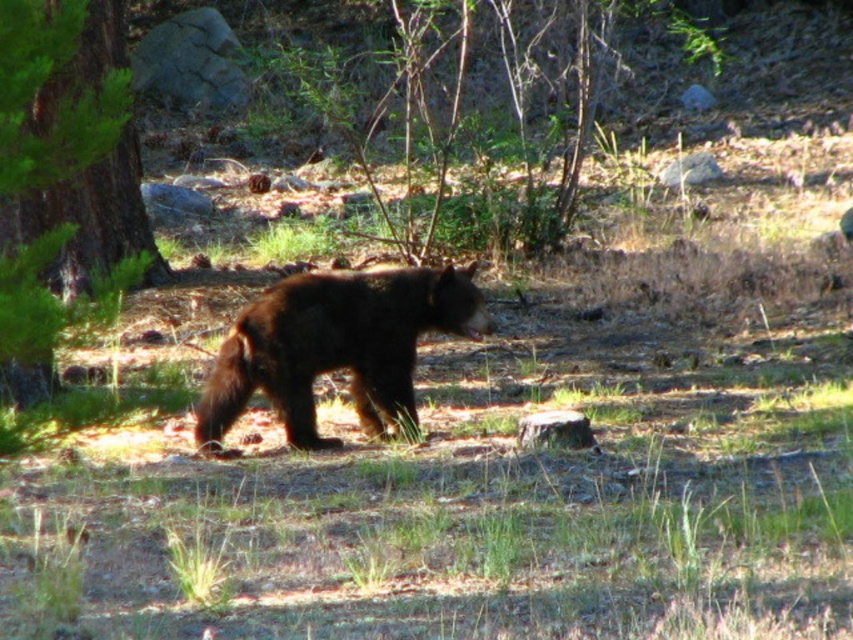
Question: Can you confirm if shiny dark brown bear at center is wider than green leafy tree at left?

Choices:
 (A) yes
 (B) no

Answer: (A)

Question: Can you confirm if shiny dark brown bear at center is positioned below green leafy tree at left?

Choices:
 (A) yes
 (B) no

Answer: (A)

Question: Which object appears farthest from the camera in this image?

Choices:
 (A) shiny dark brown bear at center
 (B) green leafy tree at left

Answer: (A)

Question: Can you confirm if shiny dark brown bear at center is smaller than green leafy tree at left?

Choices:
 (A) no
 (B) yes

Answer: (B)

Question: Among these objects, which one is farthest from the camera?

Choices:
 (A) green leafy tree at left
 (B) shiny dark brown bear at center

Answer: (B)

Question: Which point is closer to the camera?

Choices:
 (A) shiny dark brown bear at center
 (B) green leafy tree at left

Answer: (B)